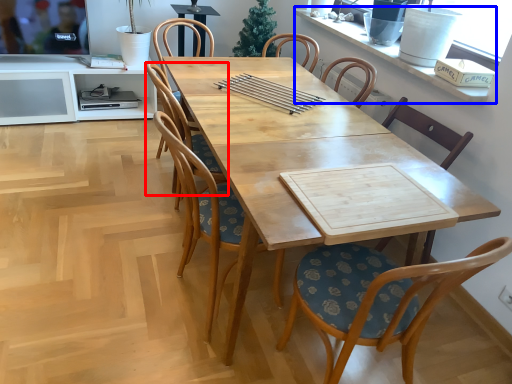
Question: Among these objects, which one is nearest to the camera, chair (highlighted by a red box) or window sill (highlighted by a blue box)?

Choices:
 (A) chair
 (B) window sill

Answer: (B)